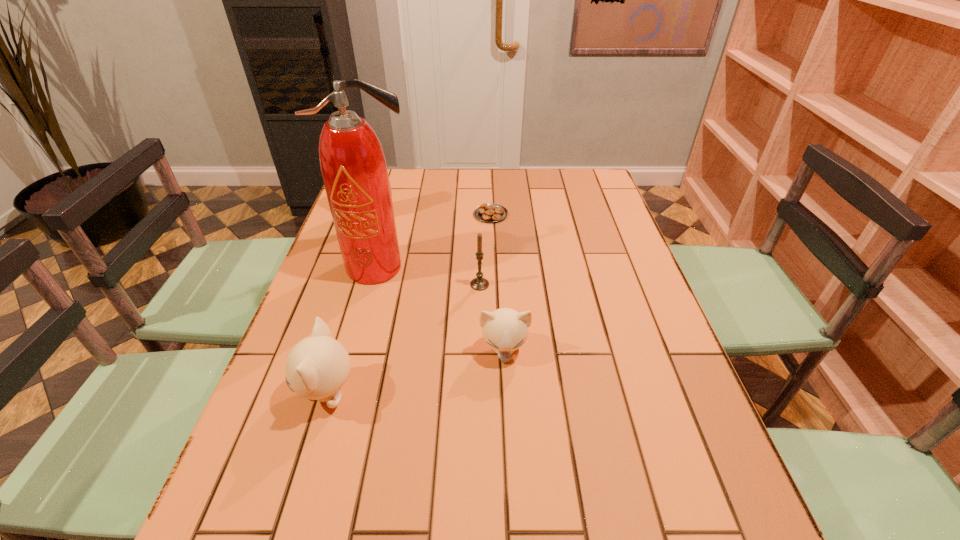
Identify which object is the closest to the candle. Please provide its 2D coordinates. Your answer should be formatted as a tuple, i.e. [(x, y)], where the tuple contains the x and y coordinates of a point satisfying the conditions above.

[(505, 330)]